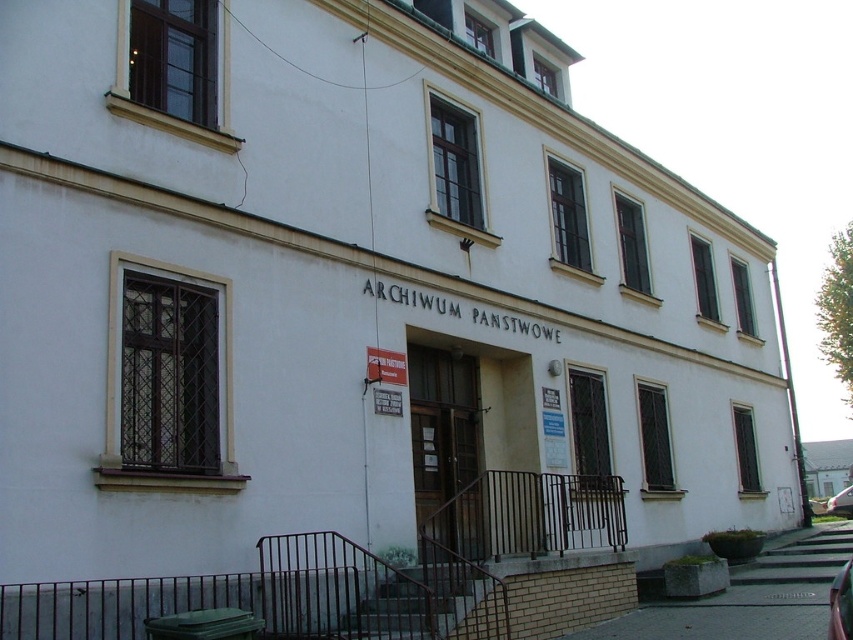
Question: Is shiny red car at center above metallic silver car at lower right?

Choices:
 (A) yes
 (B) no

Answer: (A)

Question: Which of the following is the farthest from the observer?

Choices:
 (A) metallic silver car at lower right
 (B) shiny red car at center

Answer: (A)

Question: Can you confirm if shiny red car at center is smaller than metallic silver car at lower right?

Choices:
 (A) yes
 (B) no

Answer: (A)

Question: Which point is closer to the camera?

Choices:
 (A) (x=837, y=497)
 (B) (x=831, y=602)

Answer: (B)

Question: Can you confirm if shiny red car at center is positioned below metallic silver car at lower right?

Choices:
 (A) yes
 (B) no

Answer: (B)

Question: Which of the following is the closest to the observer?

Choices:
 (A) metallic silver car at lower right
 (B) shiny red car at center

Answer: (B)